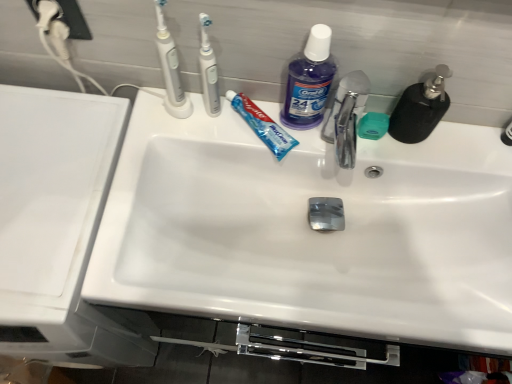
I want to click on free space to the left of blue glossy toothpaste at center, so (x=185, y=135).